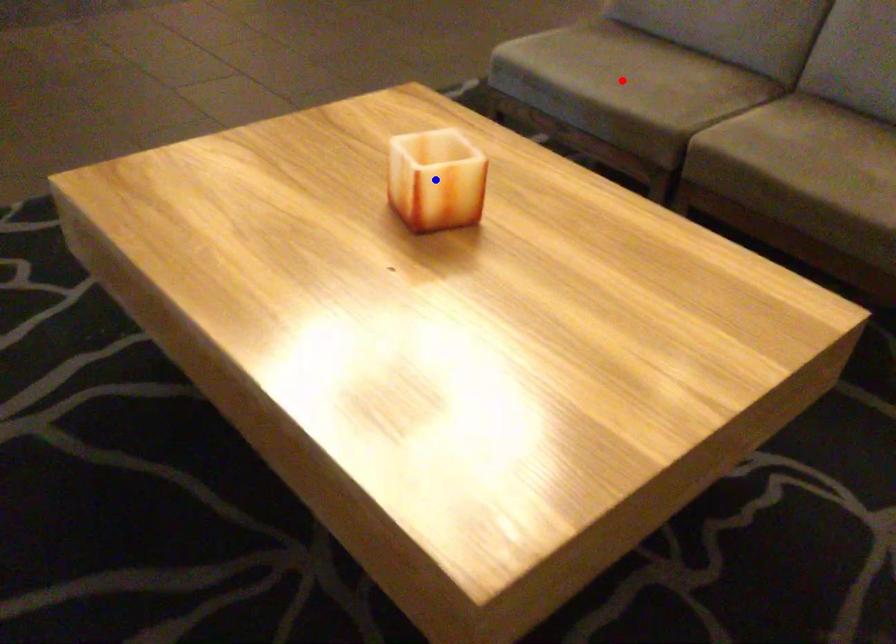
Question: Which of the two points in the image is closer to the camera?

Choices:
 (A) Blue point is closer.
 (B) Red point is closer.

Answer: (A)